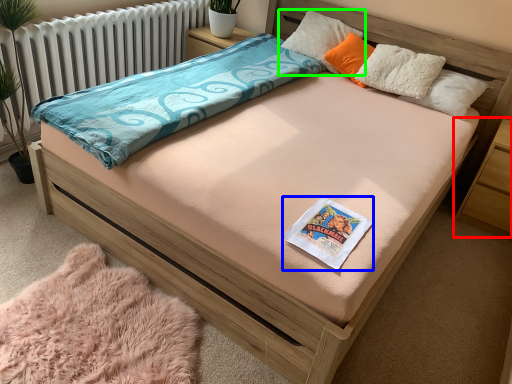
Question: Which object is the farthest from nightstand (highlighted by a red box)? Choose among these: book (highlighted by a blue box) or pillow (highlighted by a green box).

Choices:
 (A) book
 (B) pillow

Answer: (A)